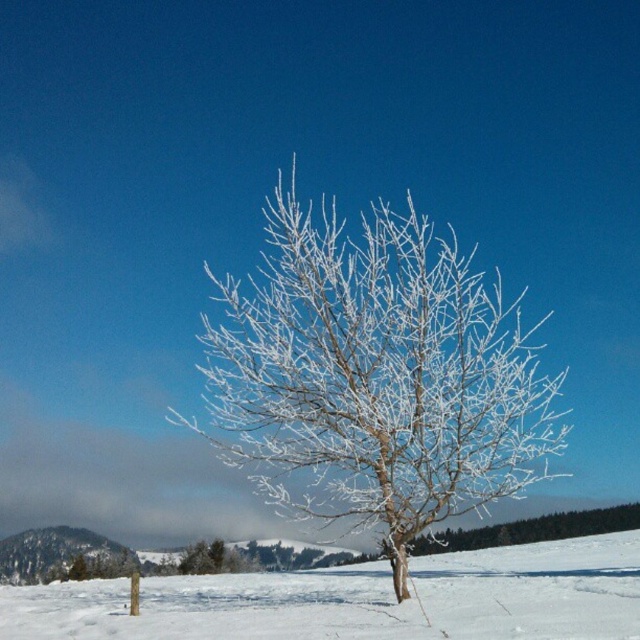
Question: Which of the following is the farthest from the observer?

Choices:
 (A) white frosty snow at center
 (B) frosted white tree at center

Answer: (B)

Question: Is frosted white tree at center bigger than white frosty snow at center?

Choices:
 (A) no
 (B) yes

Answer: (A)

Question: Can you confirm if frosted white tree at center is smaller than white frosty snow at center?

Choices:
 (A) no
 (B) yes

Answer: (B)

Question: Is the position of frosted white tree at center more distant than that of white frosty snow at center?

Choices:
 (A) no
 (B) yes

Answer: (B)

Question: Which point is closer to the camera?

Choices:
 (A) (500, 552)
 (B) (561, 374)

Answer: (B)

Question: Which point is closer to the camera taking this photo?

Choices:
 (A) (333, 330)
 (B) (289, 576)

Answer: (A)